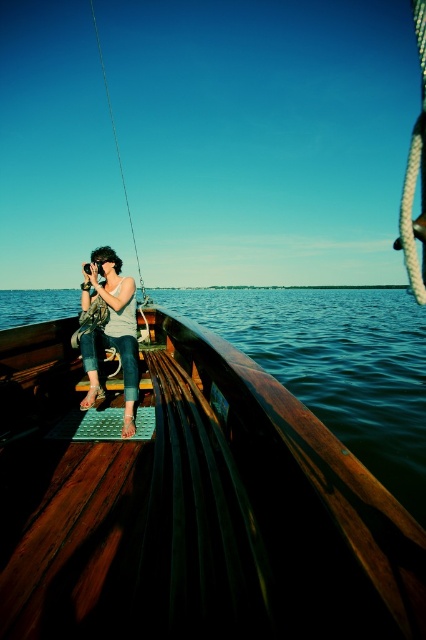
Question: Estimate the real-world distances between objects in this image. Which object is farther from the wooden boat at center?

Choices:
 (A) metallic wire fishing pole at upper left
 (B) matte white tank top at center

Answer: (A)

Question: Is matte white tank top at center positioned behind metallic wire fishing pole at upper left?

Choices:
 (A) yes
 (B) no

Answer: (B)

Question: Which point is closer to the camera?

Choices:
 (A) matte white tank top at center
 (B) wooden boat at center
 (C) metallic wire fishing pole at upper left

Answer: (B)

Question: Which object is the farthest from the matte white tank top at center?

Choices:
 (A) metallic wire fishing pole at upper left
 (B) wooden boat at center

Answer: (A)

Question: Does matte white tank top at center have a lesser width compared to metallic wire fishing pole at upper left?

Choices:
 (A) no
 (B) yes

Answer: (B)

Question: Can you confirm if matte white tank top at center is positioned to the right of metallic wire fishing pole at upper left?

Choices:
 (A) no
 (B) yes

Answer: (B)